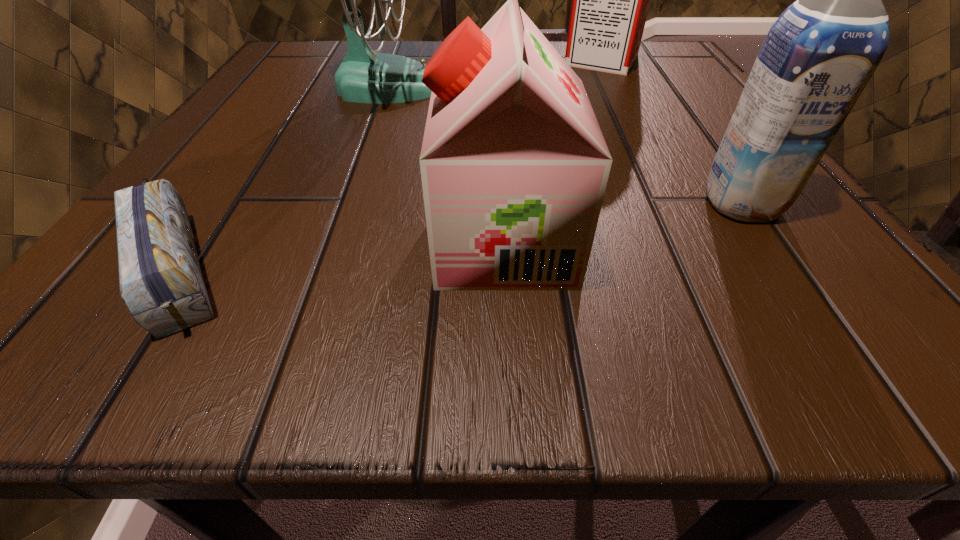
I want to click on fan, so click(x=364, y=76).

In order to click on the farthest soya milk in this screenshot , I will do `click(610, 0)`.

Locate an element on the screen. This screenshot has width=960, height=540. the shortest soya milk is located at coordinates (514, 166).

The width and height of the screenshot is (960, 540). I want to click on the third object from right to left, so (514, 166).

This screenshot has height=540, width=960. I want to click on pencil box, so click(160, 279).

Locate an element on the screen. Image resolution: width=960 pixels, height=540 pixels. vacant region located in front of the fan, directing airflow is located at coordinates (557, 86).

The height and width of the screenshot is (540, 960). In order to click on vacant point located on the left of the farthest soya milk in this screenshot , I will do `click(377, 59)`.

You are a GUI agent. You are given a task and a screenshot of the screen. Output one action in this format:
    pyautogui.click(x=<x>, y=<y>)
    Task: Click on the free point located with the cap open on the third object from right to left
    The image size is (960, 540).
    Given the screenshot: What is the action you would take?
    pyautogui.click(x=362, y=241)

In order to click on blank space located 0.160m with the cap open on the third object from right to left in this screenshot , I will do `click(285, 241)`.

This screenshot has height=540, width=960. In order to click on free point located with the cap open on the third object from right to left in this screenshot , I will do `click(314, 241)`.